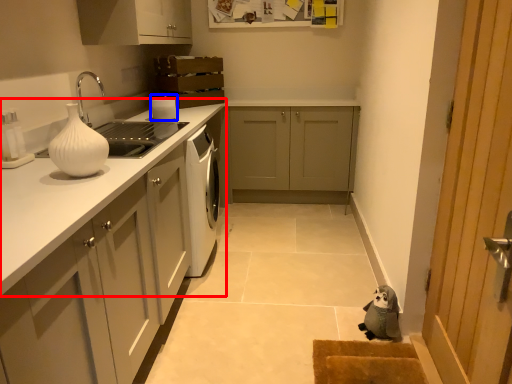
Question: Which point is closer to the camera, countertop (highlighted by a red box) or appliance (highlighted by a blue box)?

Choices:
 (A) countertop
 (B) appliance

Answer: (A)